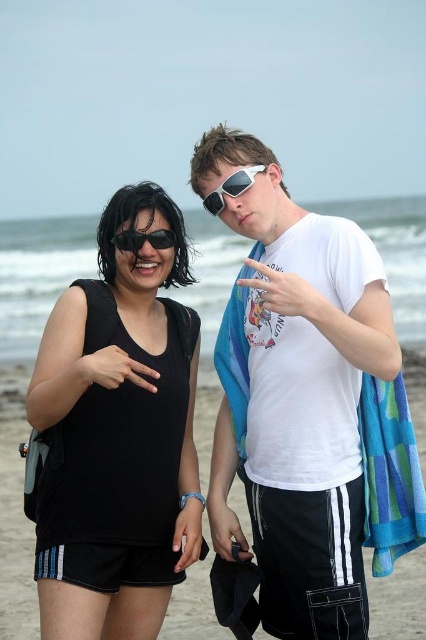
Question: Which of the following is the farthest from the observer?

Choices:
 (A) black matte tank top at left
 (B) white plastic sunglasses at upper center
 (C) blue striped towel at lower right

Answer: (B)

Question: Among these points, which one is farthest from the camera?

Choices:
 (A) (304, 454)
 (B) (391, 477)

Answer: (A)

Question: In this image, where is white matte t-shirt at center located relative to white plastic sunglasses at upper center?

Choices:
 (A) left
 (B) right

Answer: (B)

Question: From the image, what is the correct spatial relationship of black fabric shorts at lower center in relation to black matte sunglasses at upper left?

Choices:
 (A) above
 (B) below

Answer: (B)

Question: Among these objects, which one is nearest to the camera?

Choices:
 (A) white plastic sunglasses at upper center
 (B) blue striped towel at lower right

Answer: (B)

Question: Is white matte t-shirt at center bigger than black matte sunglasses at upper left?

Choices:
 (A) yes
 (B) no

Answer: (A)